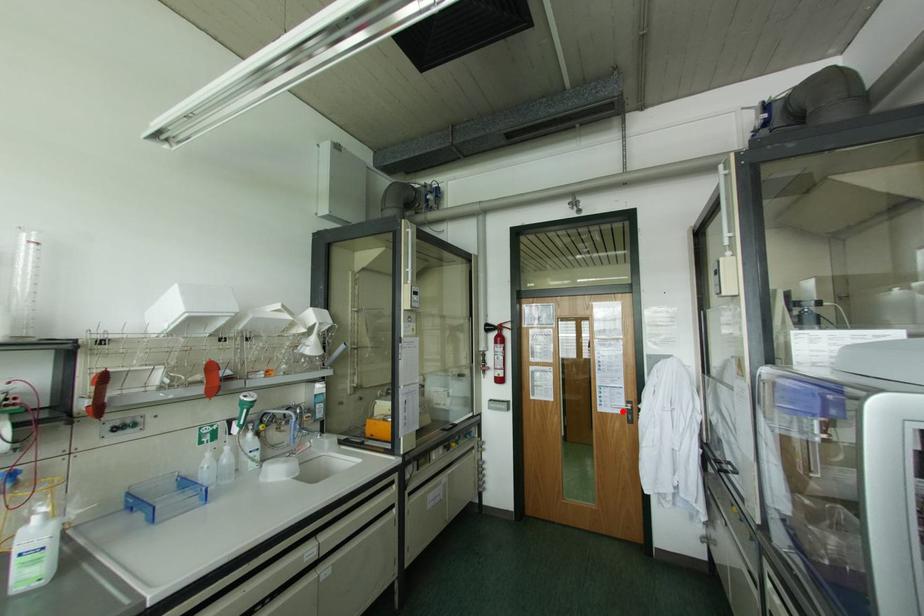
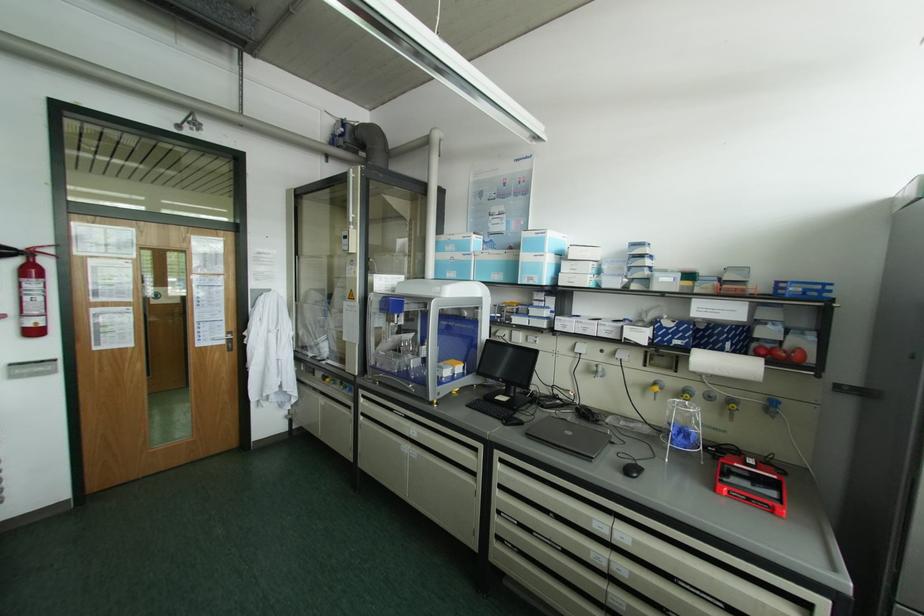
In the second image, find the point that corresponds to the highlighted location in the first image.

(224, 342)